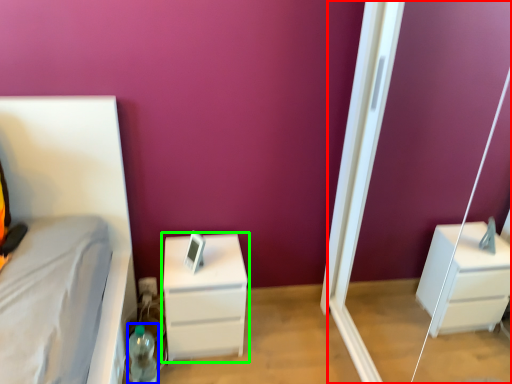
Question: Considering the real-world distances, which object is closest to screen door (highlighted by a red box)? bottle (highlighted by a blue box) or chest of drawers (highlighted by a green box).

Choices:
 (A) bottle
 (B) chest of drawers

Answer: (B)